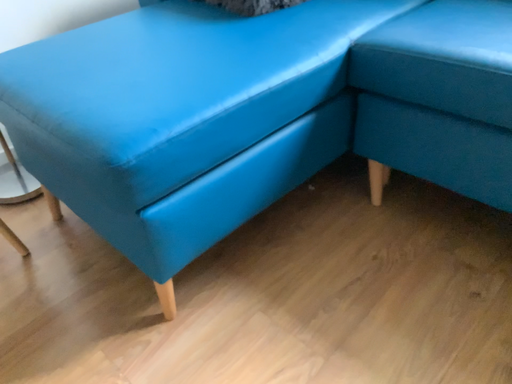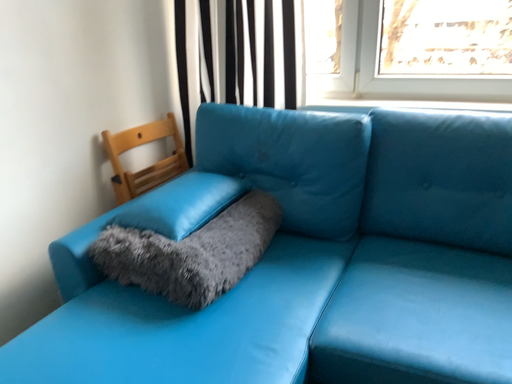
Question: How did the camera likely rotate when shooting the video?

Choices:
 (A) rotated downward
 (B) rotated upward

Answer: (B)